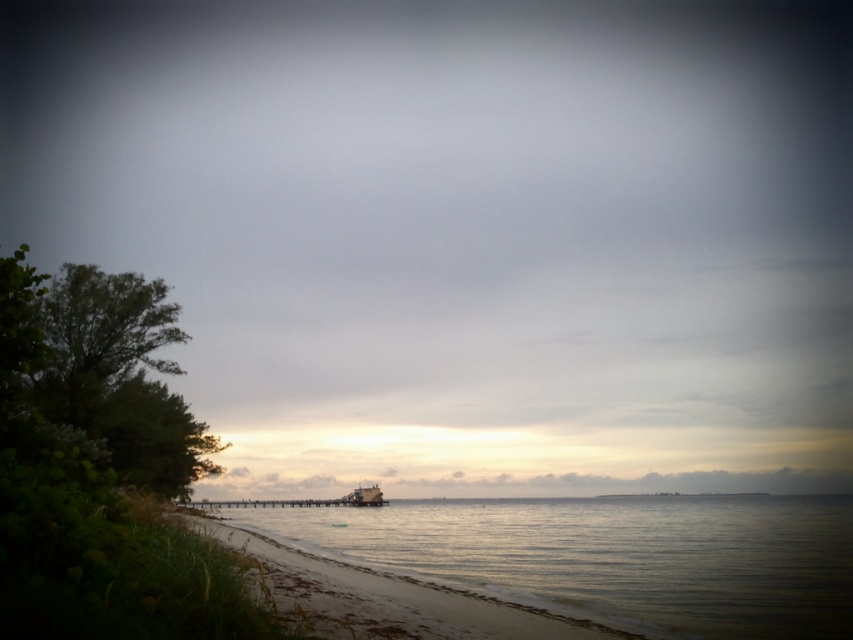
Is point (724, 632) closer to camera compared to point (360, 483)?

Yes, it is.

Is clear water at lower left to the left of metallic gray boat at center from the viewer's perspective?

Incorrect, clear water at lower left is not on the left side of metallic gray boat at center.

Who is more forward, (676, 589) or (387, 500)?

Positioned in front is point (676, 589).

Find the location of `clear water at lower left`. clear water at lower left is located at coordinates (611, 556).